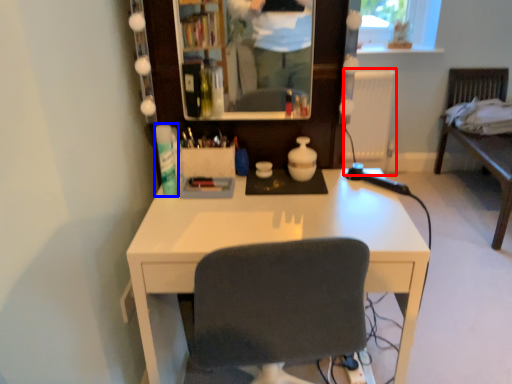
Question: Among these objects, which one is nearest to the camera, radiator (highlighted by a red box) or toiletry (highlighted by a blue box)?

Choices:
 (A) radiator
 (B) toiletry

Answer: (B)